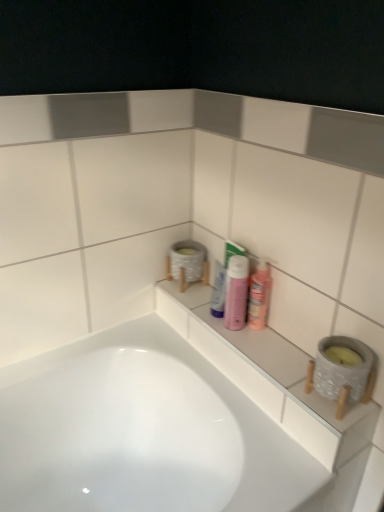
Locate an element on the screen. Image resolution: width=384 pixels, height=512 pixels. blank space situated above white ceramic ledge at center (from a real-world perspective) is located at coordinates (243, 333).